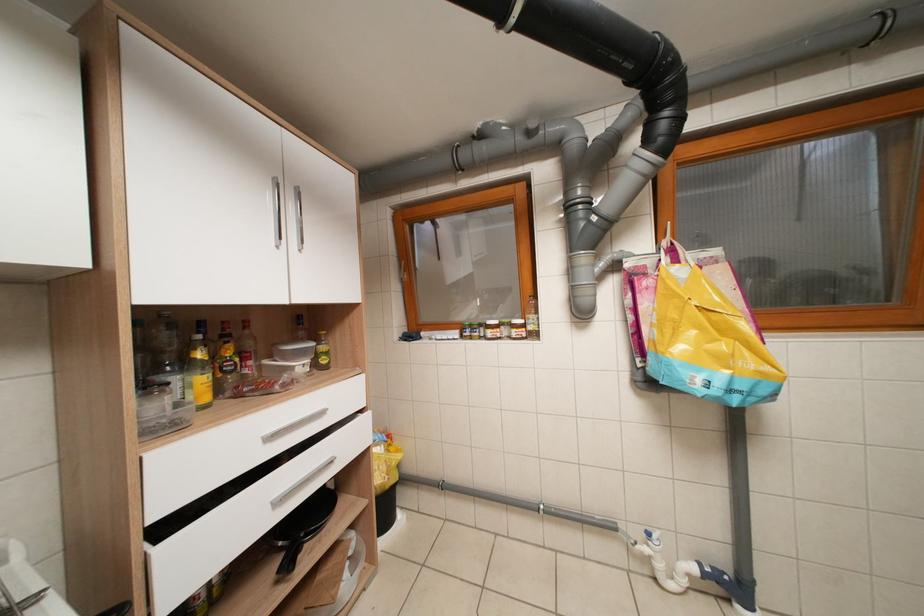
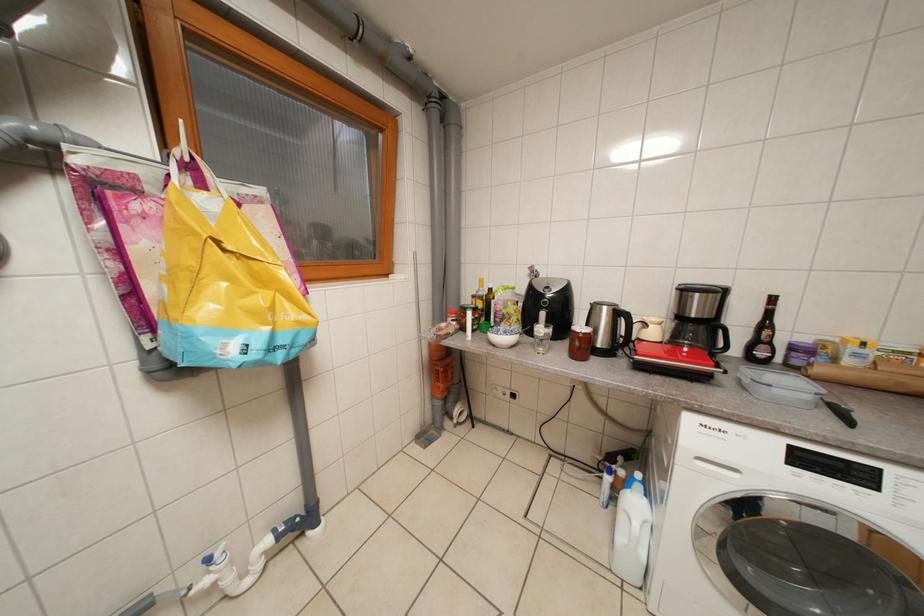
Question: Based on the continuous images, in which direction is the camera rotating? Reply with the corresponding letter.

Choices:
 (A) Left
 (B) Right
 (C) Up
 (D) Down

Answer: (B)